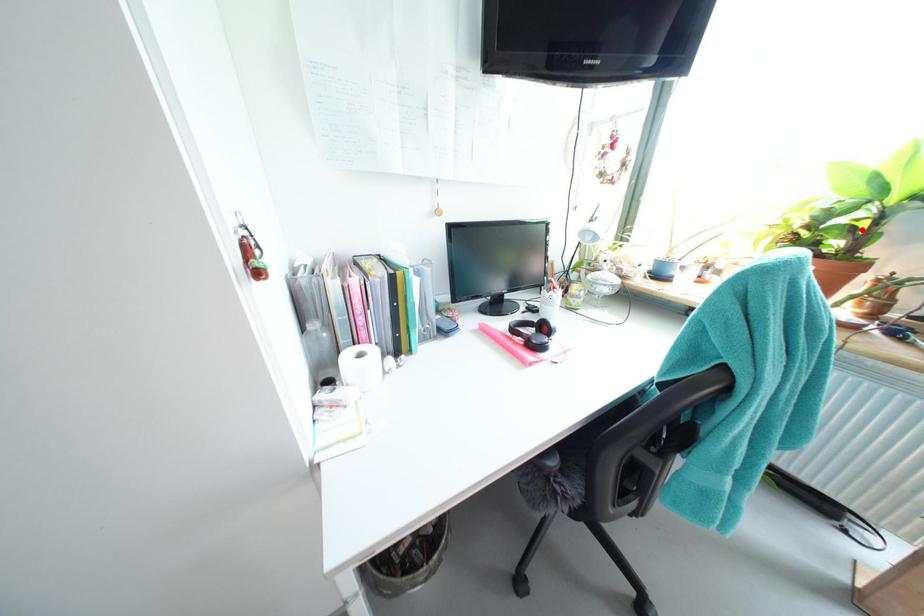
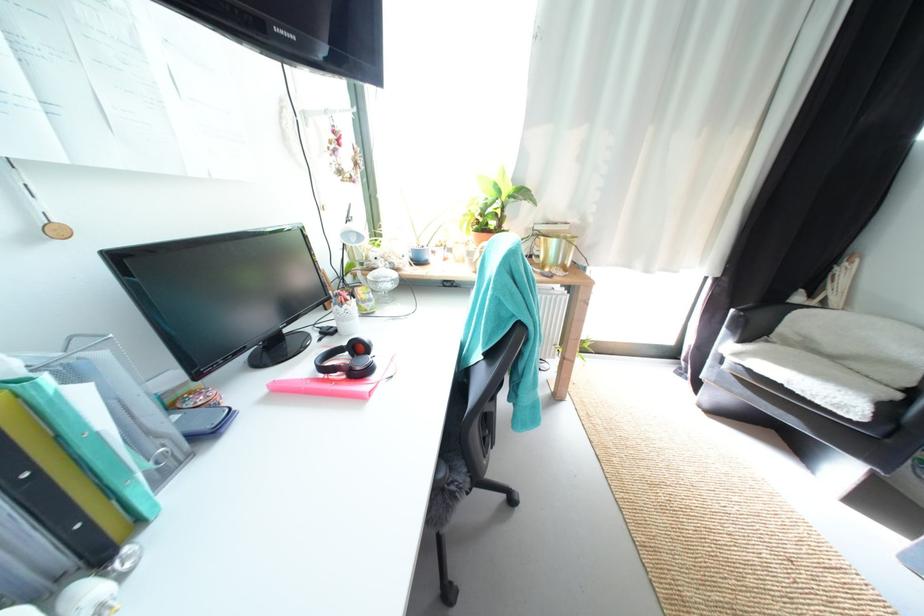
Question: A red point is marked in image1. In image2, is the corresponding 3D point closer to the camera or farther? Reply with the corresponding letter.

Choices:
 (A) The corresponding 3D point is closer.
 (B) The corresponding 3D point is farther.

Answer: (A)